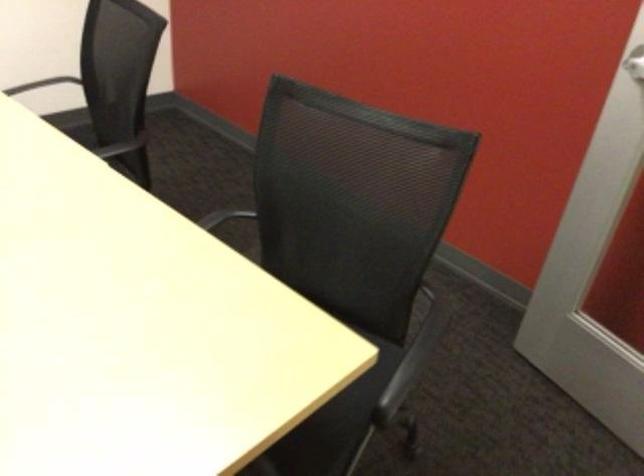
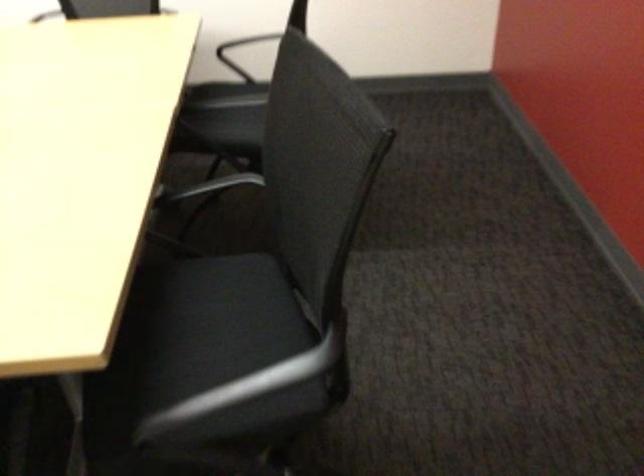
In the second image, find the point that corresponds to the point at 199,230 in the first image.

(209, 186)